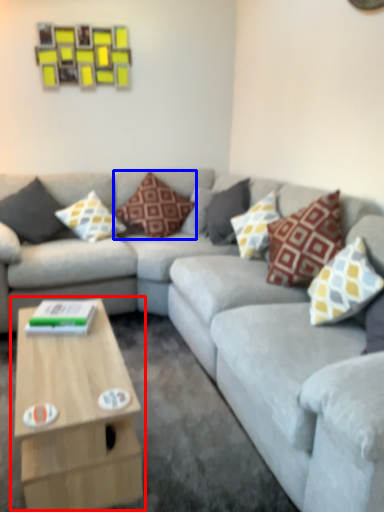
Question: Which of the following is the farthest to the observer, coffee table (highlighted by a red box) or pillow (highlighted by a blue box)?

Choices:
 (A) coffee table
 (B) pillow

Answer: (B)